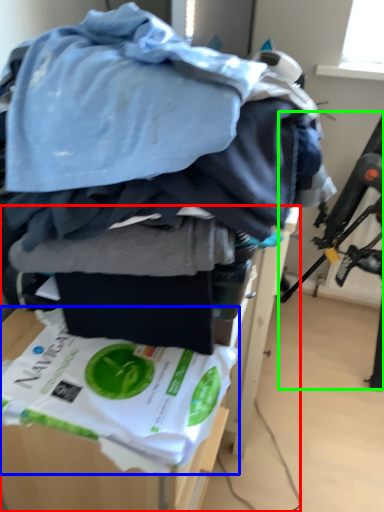
Question: Estimate the real-world distances between objects in this image. Which object is closer to furniture (highlighted by a red box), waste (highlighted by a blue box) or swivel chair (highlighted by a green box)?

Choices:
 (A) waste
 (B) swivel chair

Answer: (A)